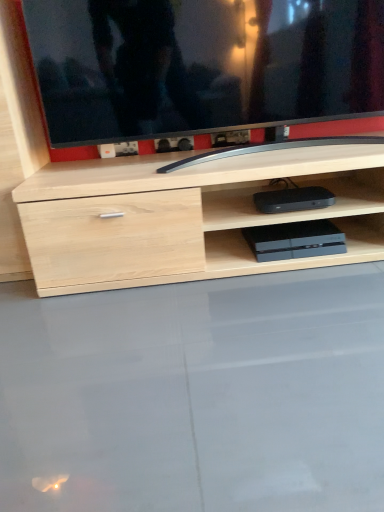
You are a GUI agent. You are given a task and a screenshot of the screen. Output one action in this format:
    pyautogui.click(x=<x>, y=<y>)
    Task: Click on the slate gray plastic game console at lower center, which is counted as the first equipment, starting from the bottom
    Image resolution: width=384 pixels, height=512 pixels.
    Given the screenshot: What is the action you would take?
    pyautogui.click(x=295, y=240)

The image size is (384, 512). Describe the element at coordinates (293, 199) in the screenshot. I see `black plastic device at center, placed as the first equipment when sorted from top to bottom` at that location.

Identify the location of slate gray plastic game console at lower center, which is counted as the first equipment, starting from the bottom. (295, 240).

Is slate gray plastic game console at lower center, the second equipment when ordered from top to bottom, facing towards black plastic device at center, the 2th equipment when ordered from bottom to top?

No, slate gray plastic game console at lower center, the second equipment when ordered from top to bottom, is not facing towards black plastic device at center, the 2th equipment when ordered from bottom to top.

Is slate gray plastic game console at lower center, the second equipment when ordered from top to bottom, situated inside black plastic device at center, the 2th equipment when ordered from bottom to top, or outside?

slate gray plastic game console at lower center, the second equipment when ordered from top to bottom, is not enclosed by black plastic device at center, the 2th equipment when ordered from bottom to top.

Relative to black plastic device at center, the 2th equipment when ordered from bottom to top, is slate gray plastic game console at lower center, the second equipment when ordered from top to bottom, in front or behind?

Visually, slate gray plastic game console at lower center, the second equipment when ordered from top to bottom, is located behind black plastic device at center, the 2th equipment when ordered from bottom to top.

Considering the positions of point (320, 247) and point (273, 211), is point (320, 247) closer or farther from the camera than point (273, 211)?

Point (320, 247) is positioned farther from the camera compared to point (273, 211).

Relative to black glossy tv at upper center, is slate gray plastic game console at lower center, the second equipment when ordered from top to bottom, in front or behind?

In the image, slate gray plastic game console at lower center, the second equipment when ordered from top to bottom, appears behind black glossy tv at upper center.

Which is closer, (284, 236) or (107, 41)?

Clearly, point (284, 236) is more distant from the camera than point (107, 41).

From a real-world perspective, is black plastic device at center, placed as the first equipment when sorted from top to bottom, positioned above or below transparent glass table at lower center?

Clearly, from a real-world perspective, black plastic device at center, placed as the first equipment when sorted from top to bottom, is above transparent glass table at lower center.

From the picture: Between black plastic device at center, the 2th equipment when ordered from bottom to top, and transparent glass table at lower center, which one has larger width?

transparent glass table at lower center.

Is black plastic device at center, the 2th equipment when ordered from bottom to top, not inside transparent glass table at lower center?

That's correct, black plastic device at center, the 2th equipment when ordered from bottom to top, is outside of transparent glass table at lower center.

Are black plastic device at center, placed as the first equipment when sorted from top to bottom, and transparent glass table at lower center making contact?

No.

Considering the relative positions of black glossy tv at upper center and black plastic device at center, the 2th equipment when ordered from bottom to top, in the image provided, is black glossy tv at upper center to the left or to the right of black plastic device at center, the 2th equipment when ordered from bottom to top,?

black glossy tv at upper center is positioned on black plastic device at center, the 2th equipment when ordered from bottom to top,'s left side.

Who is smaller, black glossy tv at upper center or black plastic device at center, the 2th equipment when ordered from bottom to top?

black plastic device at center, the 2th equipment when ordered from bottom to top, is smaller.

Is black glossy tv at upper center thinner than black plastic device at center, the 2th equipment when ordered from bottom to top?

No.

Based on the photo, from a real-world perspective, between black glossy tv at upper center and black plastic device at center, placed as the first equipment when sorted from top to bottom, who is vertically higher?

From a 3D spatial view, black glossy tv at upper center is above.

Looking at this image, considering the positions of objects black plastic device at center, placed as the first equipment when sorted from top to bottom, and slate gray plastic game console at lower center, which is counted as the first equipment, starting from the bottom, in the image provided, who is behind, black plastic device at center, placed as the first equipment when sorted from top to bottom, or slate gray plastic game console at lower center, which is counted as the first equipment, starting from the bottom,?

slate gray plastic game console at lower center, which is counted as the first equipment, starting from the bottom, is further from the camera.

Could you measure the distance between black plastic device at center, placed as the first equipment when sorted from top to bottom, and slate gray plastic game console at lower center, the second equipment when ordered from top to bottom?

black plastic device at center, placed as the first equipment when sorted from top to bottom, and slate gray plastic game console at lower center, the second equipment when ordered from top to bottom, are 3.89 inches apart.

From a real-world perspective, which object rests below the other?

slate gray plastic game console at lower center, which is counted as the first equipment, starting from the bottom, from a real-world perspective.

Is black plastic device at center, the 2th equipment when ordered from bottom to top, shorter than slate gray plastic game console at lower center, which is counted as the first equipment, starting from the bottom?

No, black plastic device at center, the 2th equipment when ordered from bottom to top, is not shorter than slate gray plastic game console at lower center, which is counted as the first equipment, starting from the bottom.

Is black glossy tv at upper center taller or shorter than slate gray plastic game console at lower center, which is counted as the first equipment, starting from the bottom?

black glossy tv at upper center is taller than slate gray plastic game console at lower center, which is counted as the first equipment, starting from the bottom.

In the scene shown: Could you tell me if black glossy tv at upper center is turned towards slate gray plastic game console at lower center, the second equipment when ordered from top to bottom?

No, black glossy tv at upper center is not aimed at slate gray plastic game console at lower center, the second equipment when ordered from top to bottom.

Is black glossy tv at upper center located outside slate gray plastic game console at lower center, which is counted as the first equipment, starting from the bottom?

Yes, black glossy tv at upper center is located beyond the bounds of slate gray plastic game console at lower center, which is counted as the first equipment, starting from the bottom.

Which point is more distant from viewer, (274, 204) or (365, 106)?

The point (365, 106) is farther from the camera.

Measure the distance between black plastic device at center, placed as the first equipment when sorted from top to bottom, and black glossy tv at upper center.

They are 42.26 centimeters apart.

Which object is positioned more to the right, black plastic device at center, placed as the first equipment when sorted from top to bottom, or black glossy tv at upper center?

From the viewer's perspective, black plastic device at center, placed as the first equipment when sorted from top to bottom, appears more on the right side.

From a real-world perspective, which is physically above, black plastic device at center, placed as the first equipment when sorted from top to bottom, or black glossy tv at upper center?

black glossy tv at upper center, from a real-world perspective.

Image resolution: width=384 pixels, height=512 pixels. In order to click on equipment that is on the left side of slate gray plastic game console at lower center, which is counted as the first equipment, starting from the bottom in this screenshot , I will do `click(293, 199)`.

This screenshot has width=384, height=512. Find the location of `television in front of the slate gray plastic game console at lower center, which is counted as the first equipment, starting from the bottom`. television in front of the slate gray plastic game console at lower center, which is counted as the first equipment, starting from the bottom is located at coordinates (202, 64).

From the image, which object appears to be farther from transparent glass table at lower center, black plastic device at center, placed as the first equipment when sorted from top to bottom, or black glossy tv at upper center?

black glossy tv at upper center lies further to transparent glass table at lower center than the other object.

Looking at the image, which one is located closer to transparent glass table at lower center, black glossy tv at upper center or slate gray plastic game console at lower center, which is counted as the first equipment, starting from the bottom?

Among the two, slate gray plastic game console at lower center, which is counted as the first equipment, starting from the bottom, is located nearer to transparent glass table at lower center.

When comparing their distances from transparent glass table at lower center, does black plastic device at center, placed as the first equipment when sorted from top to bottom, or slate gray plastic game console at lower center, the second equipment when ordered from top to bottom, seem further?

black plastic device at center, placed as the first equipment when sorted from top to bottom, is positioned further to the anchor transparent glass table at lower center.

Looking at the image, which one is located closer to black plastic device at center, the 2th equipment when ordered from bottom to top, slate gray plastic game console at lower center, which is counted as the first equipment, starting from the bottom, or transparent glass table at lower center?

slate gray plastic game console at lower center, which is counted as the first equipment, starting from the bottom, is closer to black plastic device at center, the 2th equipment when ordered from bottom to top.

When comparing their distances from transparent glass table at lower center, does slate gray plastic game console at lower center, the second equipment when ordered from top to bottom, or black plastic device at center, placed as the first equipment when sorted from top to bottom, seem further?

The object further to transparent glass table at lower center is black plastic device at center, placed as the first equipment when sorted from top to bottom.

Considering their positions, is black plastic device at center, the 2th equipment when ordered from bottom to top, positioned closer to slate gray plastic game console at lower center, the second equipment when ordered from top to bottom, than transparent glass table at lower center?

Based on the image, black plastic device at center, the 2th equipment when ordered from bottom to top, appears to be nearer to slate gray plastic game console at lower center, the second equipment when ordered from top to bottom.

Considering their positions, is transparent glass table at lower center positioned further to slate gray plastic game console at lower center, the second equipment when ordered from top to bottom, than black plastic device at center, the 2th equipment when ordered from bottom to top?

transparent glass table at lower center lies further to slate gray plastic game console at lower center, the second equipment when ordered from top to bottom, than the other object.

Considering their positions, is black plastic device at center, placed as the first equipment when sorted from top to bottom, positioned closer to black glossy tv at upper center than slate gray plastic game console at lower center, which is counted as the first equipment, starting from the bottom?

black plastic device at center, placed as the first equipment when sorted from top to bottom, is closer to black glossy tv at upper center.

I want to click on equipment between black glossy tv at upper center and slate gray plastic game console at lower center, the second equipment when ordered from top to bottom, in the up-down direction, so click(293, 199).

You are a GUI agent. You are given a task and a screenshot of the screen. Output one action in this format:
    pyautogui.click(x=<x>, y=<y>)
    Task: Click on the television located between transparent glass table at lower center and slate gray plastic game console at lower center, the second equipment when ordered from top to bottom, in the depth direction
    
    Given the screenshot: What is the action you would take?
    pyautogui.click(x=202, y=64)

Where is `television positioned between transparent glass table at lower center and black plastic device at center, placed as the first equipment when sorted from top to bottom, from near to far`? The image size is (384, 512). television positioned between transparent glass table at lower center and black plastic device at center, placed as the first equipment when sorted from top to bottom, from near to far is located at coordinates (202, 64).

Image resolution: width=384 pixels, height=512 pixels. Find the location of `equipment located between transparent glass table at lower center and slate gray plastic game console at lower center, the second equipment when ordered from top to bottom, in the depth direction`. equipment located between transparent glass table at lower center and slate gray plastic game console at lower center, the second equipment when ordered from top to bottom, in the depth direction is located at coordinates (293, 199).